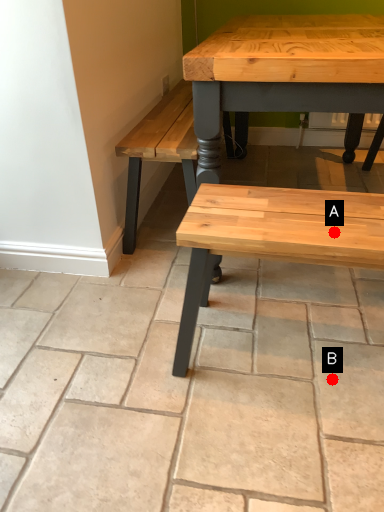
Question: Two points are circled on the image, labeled by A and B beside each circle. Which point is closer to the camera taking this photo?

Choices:
 (A) A is closer
 (B) B is closer

Answer: (A)